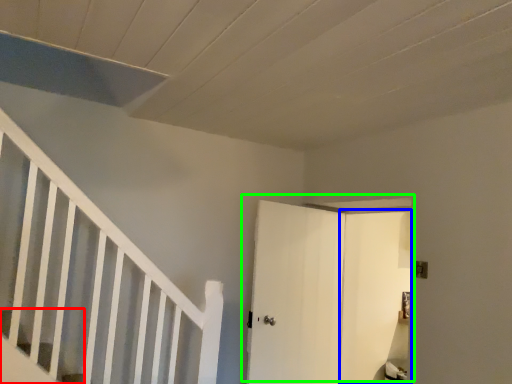
Question: Based on their relative distances, which object is farther from stairs (highlighted by a red box)? Choose from door (highlighted by a blue box) and door (highlighted by a green box).

Choices:
 (A) door
 (B) door

Answer: (A)